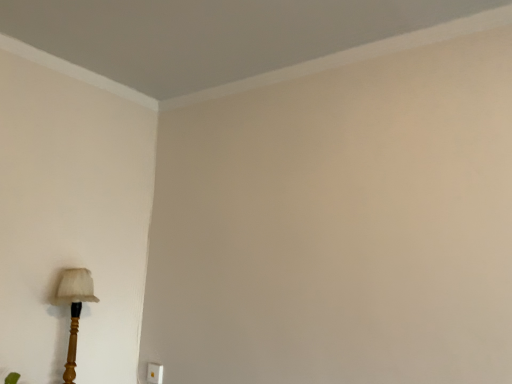
Locate an element on the screen. Image resolution: width=512 pixels, height=384 pixels. white plastic electric outlet at lower left is located at coordinates (154, 373).

This screenshot has width=512, height=384. What do you see at coordinates (154, 373) in the screenshot?
I see `white plastic electric outlet at lower left` at bounding box center [154, 373].

Describe the element at coordinates (74, 309) in the screenshot. I see `wooden lampshade at lower left` at that location.

This screenshot has width=512, height=384. In order to click on wooden lampshade at lower left in this screenshot , I will do `click(74, 309)`.

The image size is (512, 384). Find the location of `white plastic electric outlet at lower left`. white plastic electric outlet at lower left is located at coordinates (154, 373).

Which object is positioned more to the left, white plastic electric outlet at lower left or wooden lampshade at lower left?

Positioned to the left is wooden lampshade at lower left.

Is white plastic electric outlet at lower left positioned behind wooden lampshade at lower left?

Yes, white plastic electric outlet at lower left is further from the viewer.

Considering the positions of point (151, 369) and point (72, 317), is point (151, 369) closer or farther from the camera than point (72, 317)?

Point (151, 369).

From the image's perspective, is white plastic electric outlet at lower left under wooden lampshade at lower left?

Yes, from the image's perspective, white plastic electric outlet at lower left is beneath wooden lampshade at lower left.

From a real-world perspective, is white plastic electric outlet at lower left on top of wooden lampshade at lower left?

Incorrect, from a real-world perspective, white plastic electric outlet at lower left is lower than wooden lampshade at lower left.

Between white plastic electric outlet at lower left and wooden lampshade at lower left, which one has smaller width?

With smaller width is white plastic electric outlet at lower left.

Does white plastic electric outlet at lower left have a greater height compared to wooden lampshade at lower left?

No, white plastic electric outlet at lower left is not taller than wooden lampshade at lower left.

Between white plastic electric outlet at lower left and wooden lampshade at lower left, which one has smaller size?

With smaller size is white plastic electric outlet at lower left.

In the scene shown: Is white plastic electric outlet at lower left positioned beyond the bounds of wooden lampshade at lower left?

Absolutely, white plastic electric outlet at lower left is external to wooden lampshade at lower left.

From the picture: Does white plastic electric outlet at lower left touch wooden lampshade at lower left?

They are not placed beside each other.

Does white plastic electric outlet at lower left turn towards wooden lampshade at lower left?

Yes, white plastic electric outlet at lower left is aimed at wooden lampshade at lower left.

How different are the orientations of white plastic electric outlet at lower left and wooden lampshade at lower left in degrees?

white plastic electric outlet at lower left and wooden lampshade at lower left are facing 89.9 degrees away from each other.

How far apart are white plastic electric outlet at lower left and wooden lampshade at lower left?

21.02 inches.

Locate an element on the screen. This screenshot has height=384, width=512. electric outlet behind the wooden lampshade at lower left is located at coordinates (154, 373).

Visually, is wooden lampshade at lower left positioned to the left or to the right of white plastic electric outlet at lower left?

wooden lampshade at lower left is to the left of white plastic electric outlet at lower left.

Considering their positions, is wooden lampshade at lower left located in front of or behind white plastic electric outlet at lower left?

Visually, wooden lampshade at lower left is located in front of white plastic electric outlet at lower left.

Between point (69, 341) and point (159, 381), which one is positioned behind?

Positioned behind is point (159, 381).

From the image's perspective, does wooden lampshade at lower left appear lower than white plastic electric outlet at lower left?

No, from the image's perspective, wooden lampshade at lower left is not below white plastic electric outlet at lower left.

From a real-world perspective, is wooden lampshade at lower left over white plastic electric outlet at lower left?

Indeed, from a real-world perspective, wooden lampshade at lower left stands above white plastic electric outlet at lower left.

Considering the relative sizes of wooden lampshade at lower left and white plastic electric outlet at lower left in the image provided, is wooden lampshade at lower left thinner than white plastic electric outlet at lower left?

In fact, wooden lampshade at lower left might be wider than white plastic electric outlet at lower left.

Does wooden lampshade at lower left have a greater height compared to white plastic electric outlet at lower left?

Indeed, wooden lampshade at lower left has a greater height compared to white plastic electric outlet at lower left.

From the picture: Which of these two, wooden lampshade at lower left or white plastic electric outlet at lower left, is smaller?

white plastic electric outlet at lower left is smaller.

Can white plastic electric outlet at lower left be found inside wooden lampshade at lower left?

No, white plastic electric outlet at lower left is not a part of wooden lampshade at lower left.

Is wooden lampshade at lower left in contact with white plastic electric outlet at lower left?

wooden lampshade at lower left and white plastic electric outlet at lower left are not in contact.

Is wooden lampshade at lower left oriented towards white plastic electric outlet at lower left?

No, wooden lampshade at lower left does not turn towards white plastic electric outlet at lower left.

How far apart are wooden lampshade at lower left and white plastic electric outlet at lower left?

wooden lampshade at lower left is 21.02 inches from white plastic electric outlet at lower left.

Identify the location of lamp located in front of the white plastic electric outlet at lower left. (74, 309).

Find the location of a particular element. lamp in front of the white plastic electric outlet at lower left is located at coordinates (74, 309).

Image resolution: width=512 pixels, height=384 pixels. In order to click on electric outlet below the wooden lampshade at lower left (from the image's perspective) in this screenshot , I will do `click(154, 373)`.